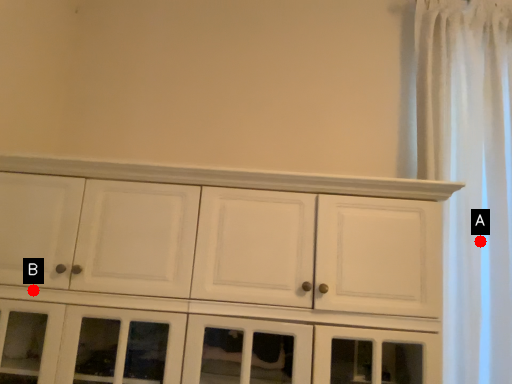
Question: Two points are circled on the image, labeled by A and B beside each circle. Which point is farther to the camera?

Choices:
 (A) A is further
 (B) B is further

Answer: (A)